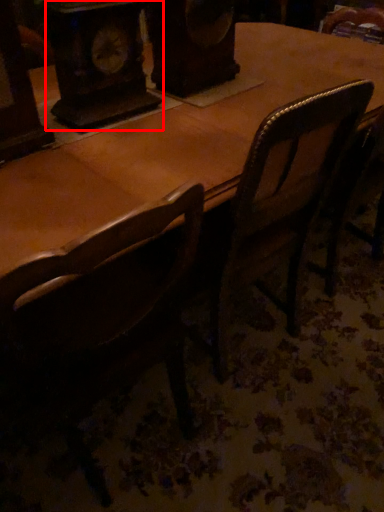
Question: From the image's perspective, what is the correct spatial relationship of clock (annotated by the red box) in relation to chair?

Choices:
 (A) below
 (B) above

Answer: (B)